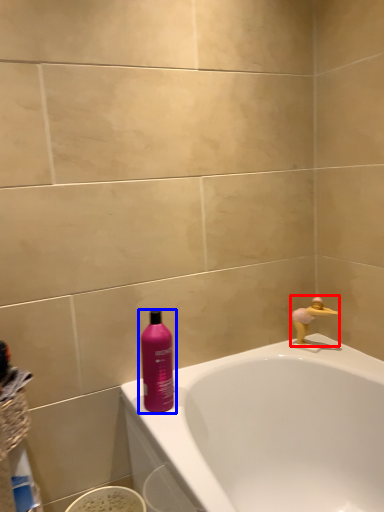
Question: Among these objects, which one is farthest to the camera, faucet (highlighted by a red box) or bottle (highlighted by a blue box)?

Choices:
 (A) faucet
 (B) bottle

Answer: (A)